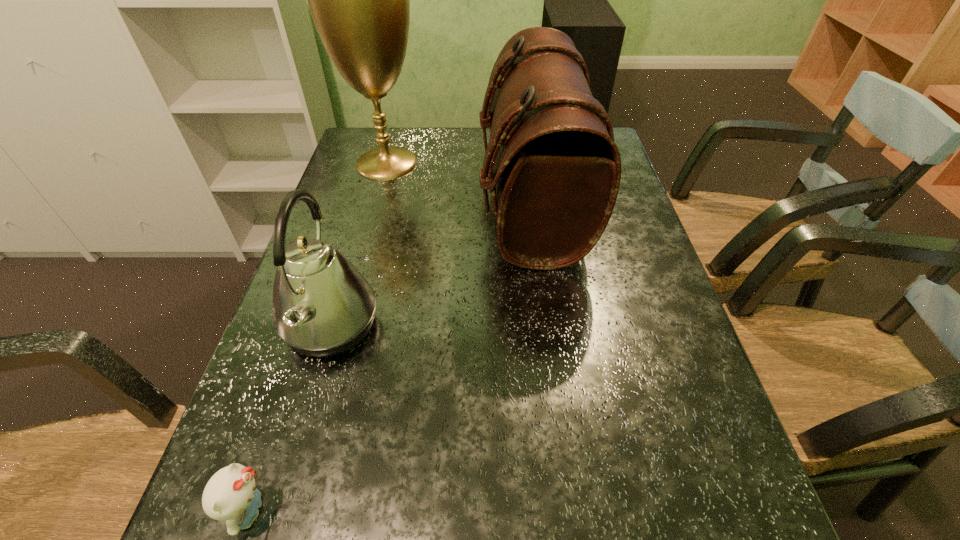
You are a GUI agent. You are given a task and a screenshot of the screen. Output one action in this format:
    pyautogui.click(x=<x>, y=<y>)
    Task: Click on the blank space at the far left corner of the desktop
    Image resolution: width=960 pixels, height=540 pixels.
    Given the screenshot: What is the action you would take?
    pyautogui.click(x=360, y=150)

Identify the location of empty location between the trophy cup and the rightmost object. The image size is (960, 540). (459, 183).

Identify the location of empty space between the rightmost object and the third farthest object. pos(431,265).

Find the location of `empty location between the rightmost object and the third tallest object`. empty location between the rightmost object and the third tallest object is located at coordinates (431, 265).

Locate an element on the screen. This screenshot has width=960, height=540. vacant space that is in between the kettle and the satchel is located at coordinates (431, 265).

The height and width of the screenshot is (540, 960). What are the coordinates of `vacant point located between the trophy cup and the kettle` in the screenshot? It's located at (359, 245).

Select which object is the second closest to the third farthest object. Please provide its 2D coordinates. Your answer should be formatted as a tuple, i.e. [(x, y)], where the tuple contains the x and y coordinates of a point satisfying the conditions above.

[(557, 170)]

This screenshot has height=540, width=960. I want to click on the second closest object to the rightmost object, so click(322, 306).